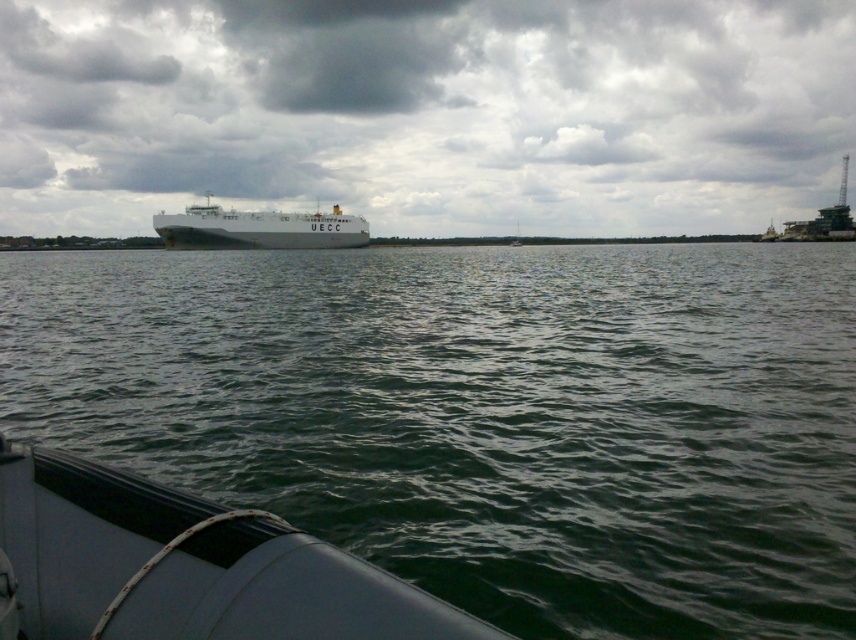
Is gray cloudy sky at upper center positioned in front of white matte boat at lower left?

No, it is not.

Does gray cloudy sky at upper center appear over white matte boat at lower left?

Yes, gray cloudy sky at upper center is above white matte boat at lower left.

The image size is (856, 640). I want to click on gray cloudy sky at upper center, so click(426, 112).

Does greenish water at center have a lesser width compared to white matte boat at lower left?

In fact, greenish water at center might be wider than white matte boat at lower left.

This screenshot has height=640, width=856. In order to click on greenish water at center in this screenshot , I will do `click(483, 416)`.

Is gray cloudy sky at upper center shorter than white matte ship at center?

No, gray cloudy sky at upper center is not shorter than white matte ship at center.

Does gray cloudy sky at upper center appear on the left side of white matte ship at center?

Incorrect, gray cloudy sky at upper center is not on the left side of white matte ship at center.

Find the location of a particular element. gray cloudy sky at upper center is located at coordinates (426, 112).

Locate an element on the screen. Image resolution: width=856 pixels, height=640 pixels. gray cloudy sky at upper center is located at coordinates (426, 112).